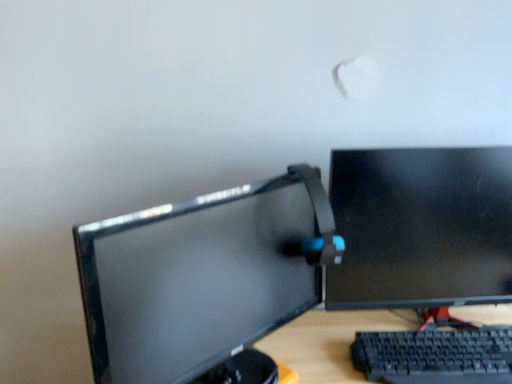
Question: Is matte black monitor at center, which appears as the first computer monitor when viewed from the left, in contact with black plastic keyboard at lower right?

Choices:
 (A) no
 (B) yes

Answer: (A)

Question: From a real-world perspective, is matte black monitor at center, arranged as the second computer monitor when viewed from the right, positioned over black plastic keyboard at lower right based on gravity?

Choices:
 (A) yes
 (B) no

Answer: (A)

Question: Is matte black monitor at center, which appears as the first computer monitor when viewed from the left, behind black plastic keyboard at lower right?

Choices:
 (A) yes
 (B) no

Answer: (B)

Question: Does matte black monitor at center, which appears as the first computer monitor when viewed from the left, have a lesser height compared to black plastic keyboard at lower right?

Choices:
 (A) no
 (B) yes

Answer: (A)

Question: Is matte black monitor at center, arranged as the second computer monitor when viewed from the right, not near black plastic keyboard at lower right?

Choices:
 (A) yes
 (B) no

Answer: (B)

Question: Can you confirm if matte black monitor at center, arranged as the second computer monitor when viewed from the right, is thinner than black plastic keyboard at lower right?

Choices:
 (A) yes
 (B) no

Answer: (A)

Question: Could you tell me if matte black monitor at center, arranged as the second computer monitor when viewed from the right, is turned towards black glossy monitor at right, the 1th computer monitor in the right-to-left sequence?

Choices:
 (A) yes
 (B) no

Answer: (B)

Question: Can you confirm if matte black monitor at center, arranged as the second computer monitor when viewed from the right, is bigger than black glossy monitor at right, the 1th computer monitor in the right-to-left sequence?

Choices:
 (A) no
 (B) yes

Answer: (B)

Question: Considering the relative sizes of matte black monitor at center, arranged as the second computer monitor when viewed from the right, and black glossy monitor at right, which appears as the 2th computer monitor when viewed from the left, in the image provided, is matte black monitor at center, arranged as the second computer monitor when viewed from the right, taller than black glossy monitor at right, which appears as the 2th computer monitor when viewed from the left,?

Choices:
 (A) no
 (B) yes

Answer: (A)

Question: Does matte black monitor at center, which appears as the first computer monitor when viewed from the left, come behind black glossy monitor at right, which appears as the 2th computer monitor when viewed from the left?

Choices:
 (A) yes
 (B) no

Answer: (B)

Question: Does matte black monitor at center, which appears as the first computer monitor when viewed from the left, have a greater width compared to black glossy monitor at right, the 1th computer monitor in the right-to-left sequence?

Choices:
 (A) no
 (B) yes

Answer: (B)

Question: Is matte black monitor at center, arranged as the second computer monitor when viewed from the right, positioned beyond the bounds of black glossy monitor at right, the 1th computer monitor in the right-to-left sequence?

Choices:
 (A) yes
 (B) no

Answer: (A)

Question: Can you confirm if black glossy monitor at right, the 1th computer monitor in the right-to-left sequence, is taller than black plastic keyboard at lower right?

Choices:
 (A) yes
 (B) no

Answer: (A)